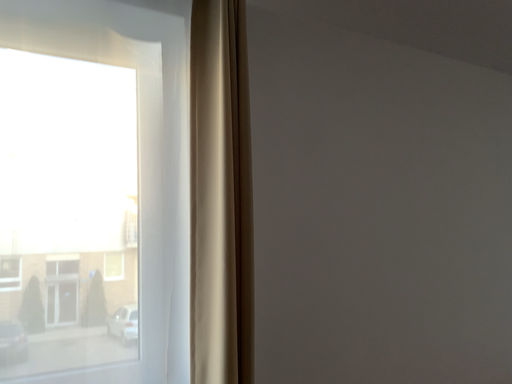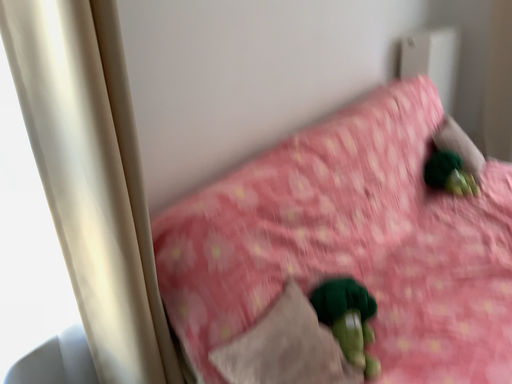
Question: How did the camera likely rotate when shooting the video?

Choices:
 (A) rotated downward
 (B) rotated upward

Answer: (A)